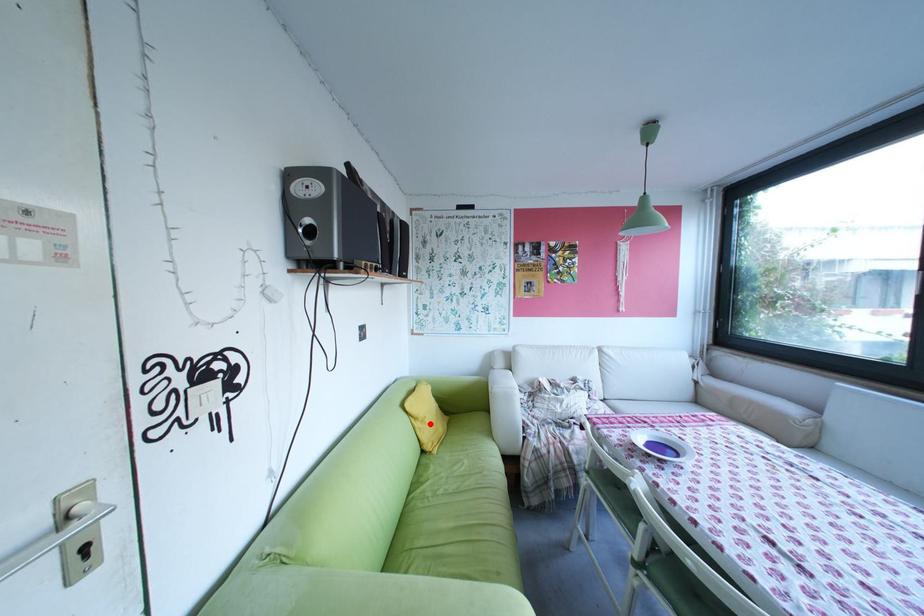
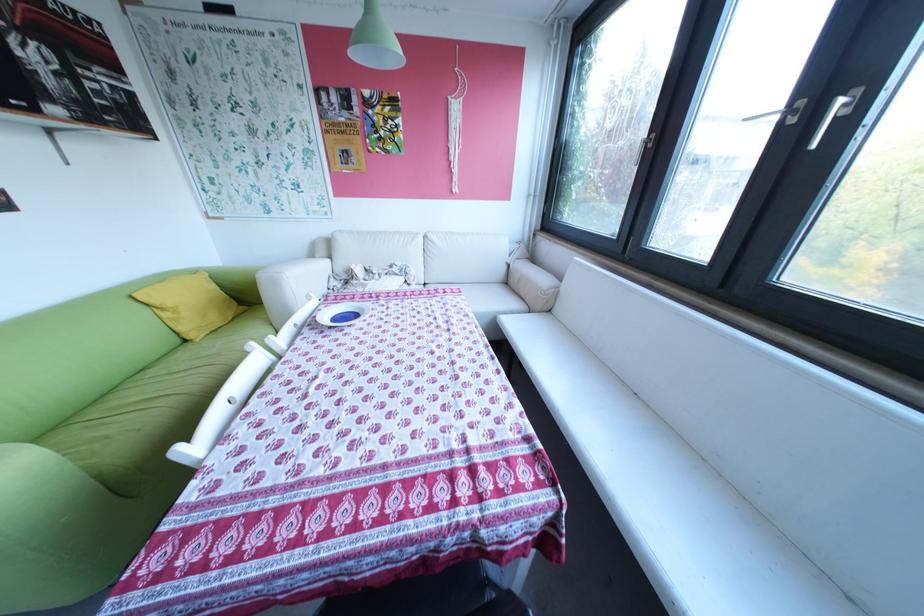
The point at the highlighted location is marked in the first image. Where is the corresponding point in the second image?

(177, 314)